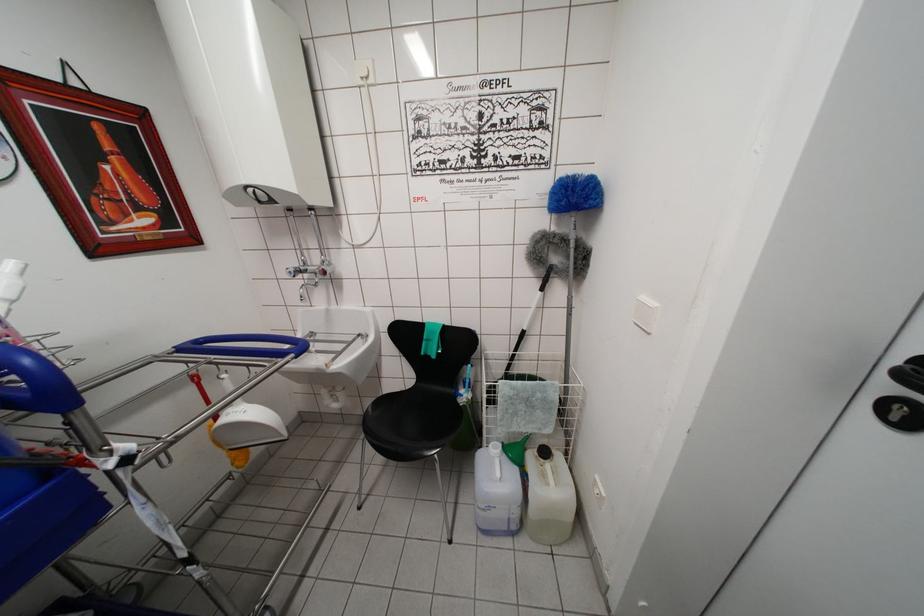
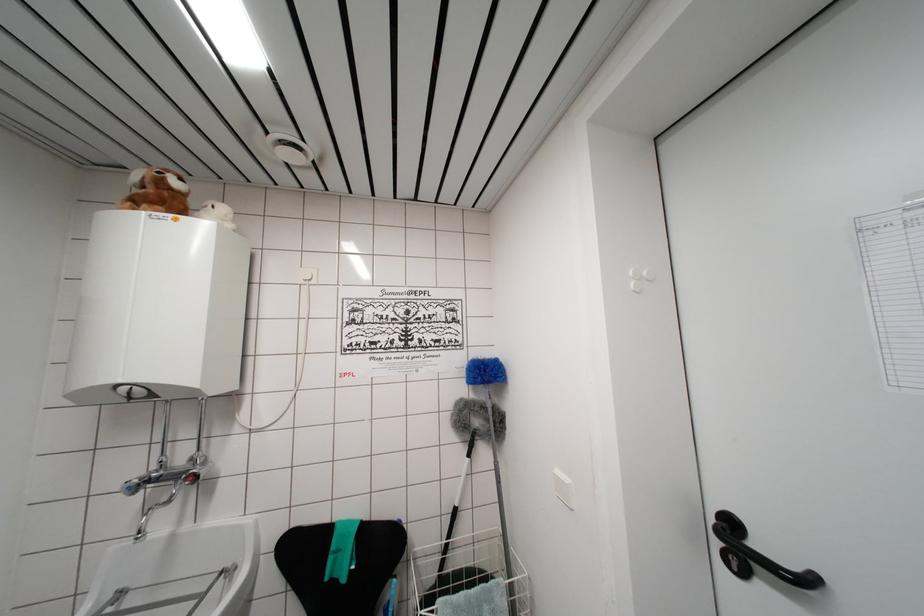
Where in the second image is the point corresponding to point 293,277 from the first image?

(132, 493)